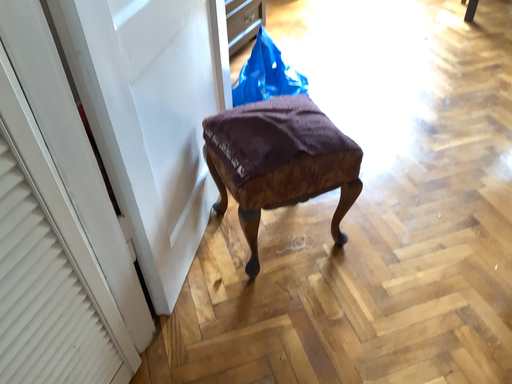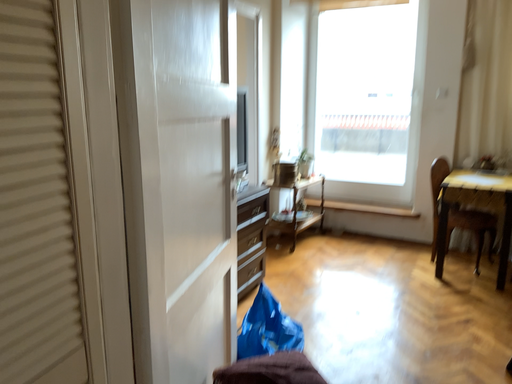
Question: How did the camera likely rotate when shooting the video?

Choices:
 (A) rotated downward
 (B) rotated upward

Answer: (B)